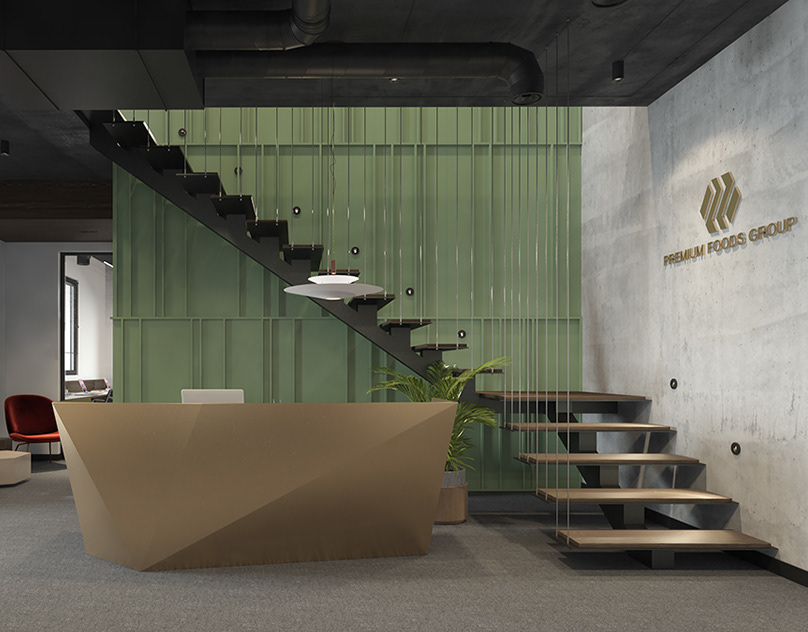
Where is `window`? Image resolution: width=808 pixels, height=632 pixels. window is located at coordinates [69, 320].